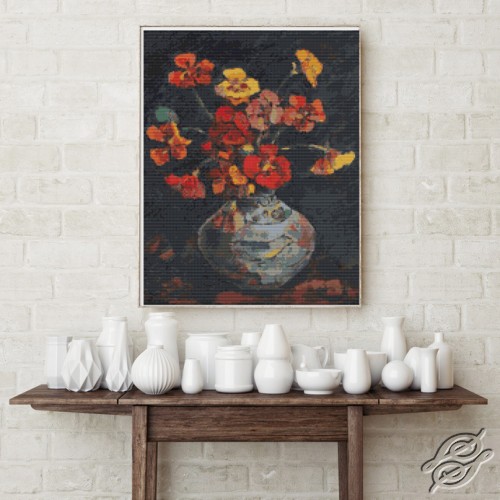
This screenshot has width=500, height=500. What are the coordinates of `vase` in the screenshot? It's located at (161, 329).